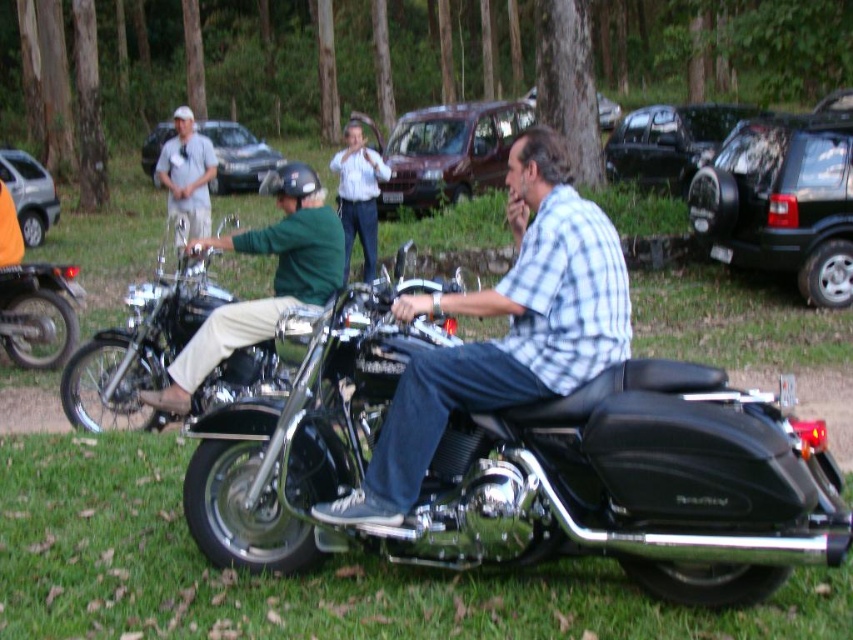
Consider the image. Can you confirm if black matte car at right is bigger than light blue shirt at center?

Indeed, black matte car at right has a larger size compared to light blue shirt at center.

Describe the element at coordinates (669, 141) in the screenshot. The width and height of the screenshot is (853, 640). I see `black matte car at right` at that location.

Measure the distance between black matte car at right and camera.

12.76 meters

Find the location of a particular element. The image size is (853, 640). black matte car at right is located at coordinates (669, 141).

Which is behind, point (764, 397) or point (317, 248)?

Point (317, 248)

Between black chrome motorcycle at center and green fabric shirt at center, which one appears on the left side from the viewer's perspective?

Positioned to the left is green fabric shirt at center.

Where is `black chrome motorcycle at center`? black chrome motorcycle at center is located at coordinates (523, 468).

Can you confirm if shiny chrome motorcycle at left is smaller than white matte cap at upper left?

Indeed, shiny chrome motorcycle at left has a smaller size compared to white matte cap at upper left.

Is shiny chrome motorcycle at left closer to camera compared to white matte cap at upper left?

That is True.

Does point (44, 268) come closer to viewer compared to point (184, 220)?

That is True.

Where is `shiny chrome motorcycle at left`? The width and height of the screenshot is (853, 640). shiny chrome motorcycle at left is located at coordinates (36, 312).